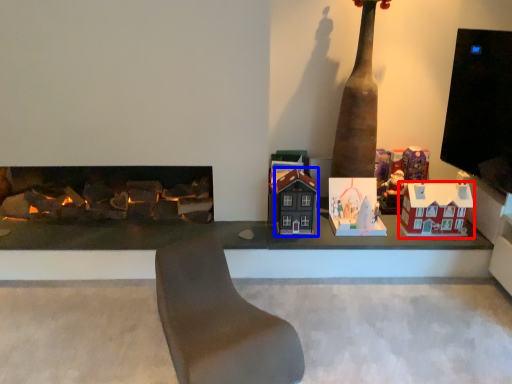
Question: Which of the following is the closest to the observer, toy (highlighted by a red box) or toy (highlighted by a blue box)?

Choices:
 (A) toy
 (B) toy

Answer: (B)